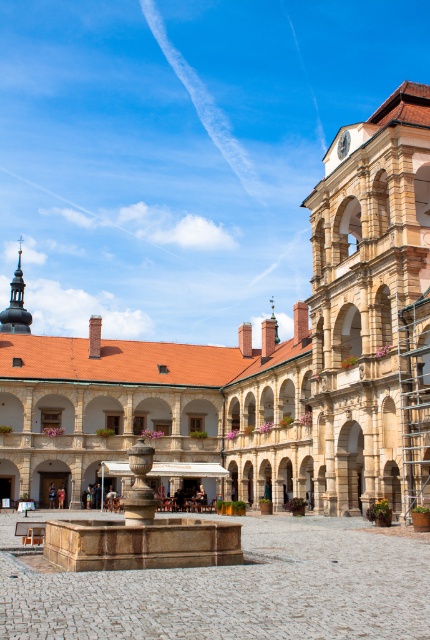
Does beige stone palace at center have a lesser width compared to marble fountain at center?

No, beige stone palace at center is not thinner than marble fountain at center.

Between point (208, 388) and point (132, 472), which one is positioned in front?

Positioned in front is point (132, 472).

This screenshot has width=430, height=640. In order to click on beige stone palace at center in this screenshot , I will do 261,358.